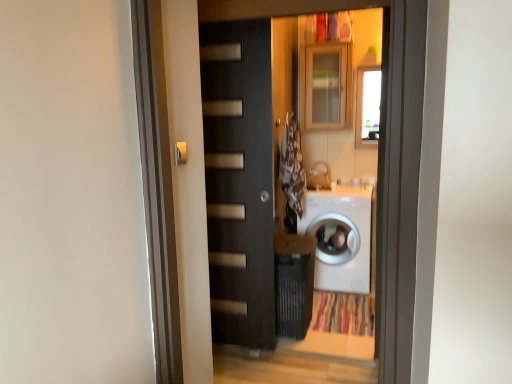
In order to face metallic silver door handle at upper center, should I rotate leftwards or rightwards?

It's best to rotate left around 9.624 degrees.

You are a GUI agent. You are given a task and a screenshot of the screen. Output one action in this format:
    pyautogui.click(x=<x>, y=<y>)
    Task: Click on the metallic silver door handle at upper center
    
    Given the screenshot: What is the action you would take?
    pyautogui.click(x=181, y=153)

In order to face wooden cabinet at upper center, should I rotate leftwards or rightwards?

You should rotate right by 9.800 degrees.

Locate an element on the screen. brown fabric laundry at center is located at coordinates (292, 167).

This screenshot has height=384, width=512. I want to click on metallic silver door handle at upper center, so click(x=181, y=153).

Who is bigger, brown fabric laundry at center or wooden cabinet at upper center?

wooden cabinet at upper center.

How many degrees apart are the facing directions of brown fabric laundry at center and wooden cabinet at upper center?

The facing directions of brown fabric laundry at center and wooden cabinet at upper center are 90 degrees apart.

Which is more to the left, brown fabric laundry at center or wooden cabinet at upper center?

brown fabric laundry at center is more to the left.

Is brown fabric laundry at center shorter than wooden cabinet at upper center?

Incorrect, the height of brown fabric laundry at center does not fall short of that of wooden cabinet at upper center.

Considering the relative sizes of brown fabric laundry at center and white glossy washing machine at center in the image provided, is brown fabric laundry at center wider than white glossy washing machine at center?

Incorrect, the width of brown fabric laundry at center does not surpass that of white glossy washing machine at center.

Where is `laundry located above the white glossy washing machine at center (from the image's perspective)`? laundry located above the white glossy washing machine at center (from the image's perspective) is located at coordinates (292, 167).

Who is taller, brown fabric laundry at center or white glossy washing machine at center?

Standing taller between the two is white glossy washing machine at center.

How many degrees apart are the facing directions of metallic silver door handle at upper center and white glossy washing machine at center?

The facing directions of metallic silver door handle at upper center and white glossy washing machine at center are 89.3 degrees apart.

Based on the photo, considering the sizes of objects metallic silver door handle at upper center and white glossy washing machine at center in the image provided, who is smaller, metallic silver door handle at upper center or white glossy washing machine at center?

Smaller between the two is metallic silver door handle at upper center.

Is metallic silver door handle at upper center inside the boundaries of white glossy washing machine at center, or outside?

metallic silver door handle at upper center is outside white glossy washing machine at center.

Does brown fabric laundry at center have a larger size compared to matte black door at center?

Incorrect, brown fabric laundry at center is not larger than matte black door at center.

Is brown fabric laundry at center beside matte black door at center?

There is a gap between brown fabric laundry at center and matte black door at center.

Image resolution: width=512 pixels, height=384 pixels. Find the location of `laundry that appears behind the matte black door at center`. laundry that appears behind the matte black door at center is located at coordinates (292, 167).

At what (x,y) coordinates should I click in order to perform the action: click on washing machine located underneath the brown fabric laundry at center (from a real-world perspective). Please return your answer as a coordinate pair (x, y). Looking at the image, I should click on (345, 237).

Is brown fabric laundry at center at the back of white glossy washing machine at center?

No, brown fabric laundry at center is not at the back of white glossy washing machine at center.

Is point (367, 237) closer to viewer compared to point (303, 171)?

That is True.

Considering the relative sizes of white glossy washing machine at center and brown fabric laundry at center in the image provided, is white glossy washing machine at center smaller than brown fabric laundry at center?

No.

In the image, is metallic silver door handle at upper center positioned in front of or behind matte black door at center?

In the image, metallic silver door handle at upper center appears in front of matte black door at center.

Does metallic silver door handle at upper center turn towards matte black door at center?

No.

How distant is metallic silver door handle at upper center from matte black door at center?

metallic silver door handle at upper center and matte black door at center are 3.45 feet apart.

Is metallic silver door handle at upper center beside matte black door at center?

They are not placed beside each other.

Is the position of matte black door at center more distant than that of metallic silver door handle at upper center?

Yes, it is.

Is matte black door at center aimed at metallic silver door handle at upper center?

Yes, matte black door at center is turned towards metallic silver door handle at upper center.

From a real-world perspective, is matte black door at center above or below metallic silver door handle at upper center?

In terms of real-world spatial position, matte black door at center is below metallic silver door handle at upper center.

Can you confirm if matte black door at center is taller than metallic silver door handle at upper center?

Indeed, matte black door at center has a greater height compared to metallic silver door handle at upper center.

Find the location of `laundry in front of the wooden cabinet at upper center`. laundry in front of the wooden cabinet at upper center is located at coordinates (292, 167).

At what (x,y) coordinates should I click in order to perform the action: click on laundry above the white glossy washing machine at center (from a real-world perspective). Please return your answer as a coordinate pair (x, y). The width and height of the screenshot is (512, 384). Looking at the image, I should click on (292, 167).

Based on their spatial positions, is matte black door at center or white glossy washing machine at center further from brown fabric laundry at center?

The object further to brown fabric laundry at center is matte black door at center.

Looking at the image, which one is located closer to matte black door at center, brown fabric laundry at center or metallic silver door handle at upper center?

brown fabric laundry at center lies closer to matte black door at center than the other object.

Based on their spatial positions, is metallic silver door handle at upper center or brown fabric laundry at center closer to white glossy washing machine at center?

Based on the image, brown fabric laundry at center appears to be nearer to white glossy washing machine at center.

Estimate the real-world distances between objects in this image. Which object is further from wooden cabinet at upper center, metallic silver door handle at upper center or white glossy washing machine at center?

metallic silver door handle at upper center is further to wooden cabinet at upper center.

Estimate the real-world distances between objects in this image. Which object is further from white glossy washing machine at center, brown fabric laundry at center or wooden cabinet at upper center?

wooden cabinet at upper center is further to white glossy washing machine at center.

Based on their spatial positions, is white glossy washing machine at center or wooden cabinet at upper center further from matte black door at center?

Among the two, wooden cabinet at upper center is located further to matte black door at center.

From the image, which object appears to be farther from metallic silver door handle at upper center, white glossy washing machine at center or brown fabric laundry at center?

white glossy washing machine at center is further to metallic silver door handle at upper center.

Considering their positions, is white glossy washing machine at center positioned further to brown fabric laundry at center than matte black door at center?

matte black door at center lies further to brown fabric laundry at center than the other object.

Identify the location of door between metallic silver door handle at upper center and wooden cabinet at upper center along the z-axis. The height and width of the screenshot is (384, 512). (239, 180).

I want to click on laundry between metallic silver door handle at upper center and wooden cabinet at upper center from front to back, so click(292, 167).

Where is `door between metallic silver door handle at upper center and brown fabric laundry at center in the front-back direction`? The width and height of the screenshot is (512, 384). door between metallic silver door handle at upper center and brown fabric laundry at center in the front-back direction is located at coordinates (239, 180).

In order to click on laundry between metallic silver door handle at upper center and white glossy washing machine at center in the front-back direction in this screenshot , I will do `click(292, 167)`.